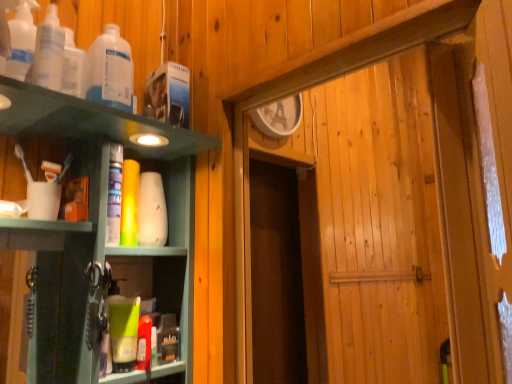
Question: Is translucent plastic bottles at upper left, which is the second bottle in front-to-back order, looking in the opposite direction of white matte cup at left?

Choices:
 (A) yes
 (B) no

Answer: (B)

Question: From a real-world perspective, is translucent plastic bottles at upper left, the second bottle from the back, under white matte cup at left?

Choices:
 (A) yes
 (B) no

Answer: (B)

Question: Is translucent plastic bottles at upper left, which is the second bottle in front-to-back order, at the right side of white matte cup at left?

Choices:
 (A) yes
 (B) no

Answer: (A)

Question: Is translucent plastic bottles at upper left, which is the second bottle in front-to-back order, at the left side of white matte cup at left?

Choices:
 (A) yes
 (B) no

Answer: (B)

Question: Does translucent plastic bottles at upper left, the second bottle from the back, have a greater height compared to white matte cup at left?

Choices:
 (A) yes
 (B) no

Answer: (A)

Question: In the image, is white matte vase at center, the 1th toiletry from the top, positioned in front of or behind translucent plastic bottles at upper left, which is the second bottle in front-to-back order?

Choices:
 (A) behind
 (B) front

Answer: (A)

Question: From a real-world perspective, is white matte vase at center, the 2th toiletry ordered from the bottom, above or below translucent plastic bottles at upper left, the second bottle from the back?

Choices:
 (A) above
 (B) below

Answer: (B)

Question: Is white matte vase at center, the 1th toiletry from the top, spatially inside translucent plastic bottles at upper left, which is the second bottle in front-to-back order, or outside of it?

Choices:
 (A) inside
 (B) outside

Answer: (B)

Question: Does point (159, 213) appear closer or farther from the camera than point (46, 44)?

Choices:
 (A) farther
 (B) closer

Answer: (A)

Question: Considering their positions, is translucent plastic bottles at upper left, the second bottle from the back, located in front of or behind translucent plastic bottle at upper left, the 1th bottle positioned from the back?

Choices:
 (A) behind
 (B) front

Answer: (B)

Question: Is translucent plastic bottles at upper left, the second bottle from the back, taller or shorter than translucent plastic bottle at upper left, the 1th bottle positioned from the back?

Choices:
 (A) short
 (B) tall

Answer: (A)

Question: From a real-world perspective, is translucent plastic bottles at upper left, the second bottle from the back, above or below translucent plastic bottle at upper left, arranged as the 3th bottle when viewed from the front?

Choices:
 (A) below
 (B) above

Answer: (A)

Question: Based on their positions, is translucent plastic bottles at upper left, which is the second bottle in front-to-back order, located to the left or right of translucent plastic bottle at upper left, the 1th bottle positioned from the back?

Choices:
 (A) left
 (B) right

Answer: (A)

Question: From the image's perspective, is green matte tube at lower left, positioned as the second toiletry in back-to-front order, located above or below translucent plastic bottles at upper left, which is the 3th bottle from back to front?

Choices:
 (A) above
 (B) below

Answer: (B)

Question: Is green matte tube at lower left, the 1th toiletry from the bottom, situated inside translucent plastic bottles at upper left, which is the 3th bottle from back to front, or outside?

Choices:
 (A) outside
 (B) inside

Answer: (A)